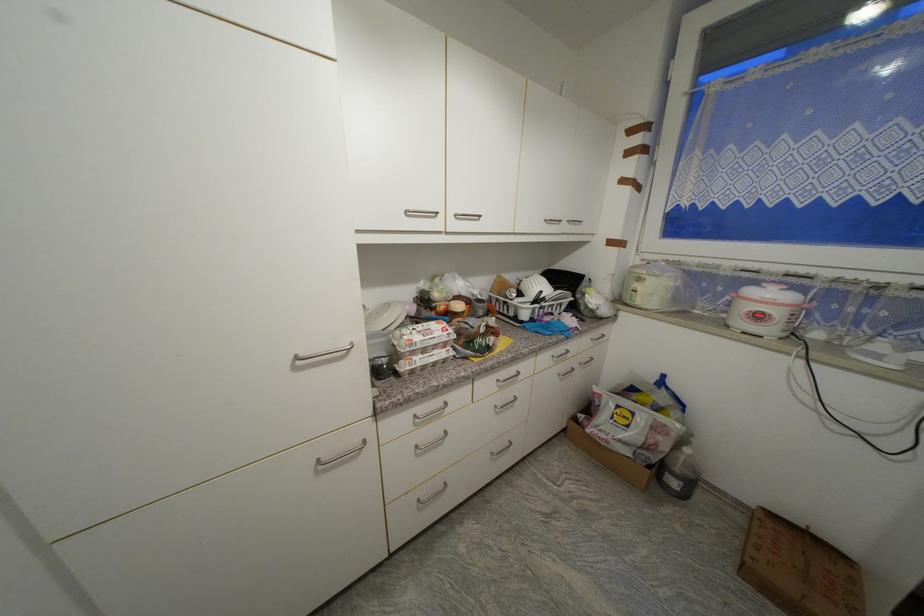
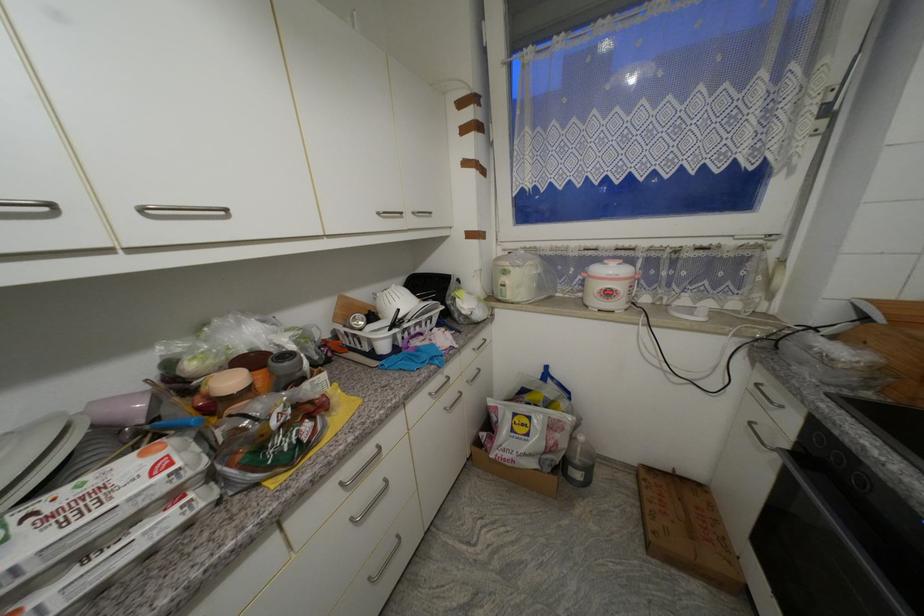
Find the pixel in the second image that matches point (504, 382) in the first image.

(347, 485)